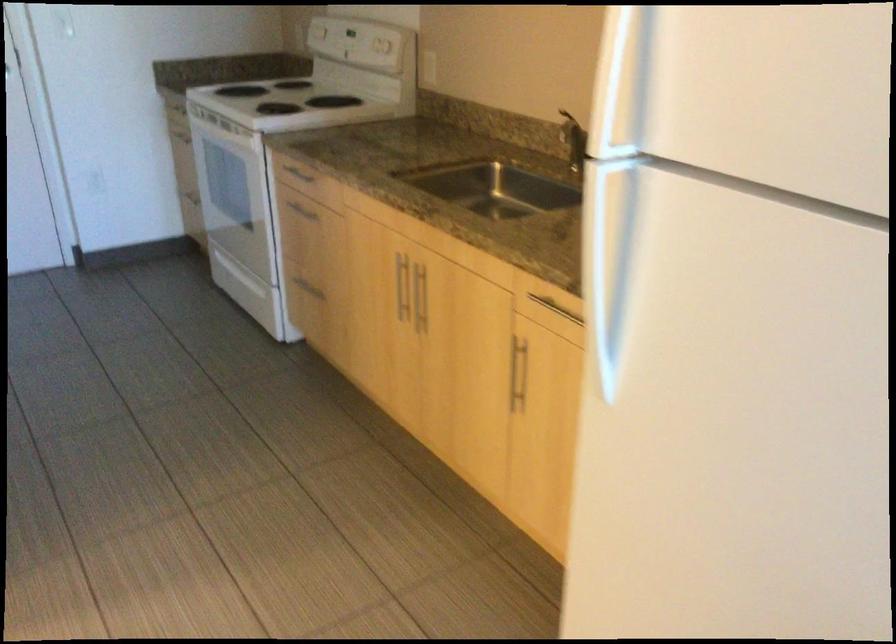
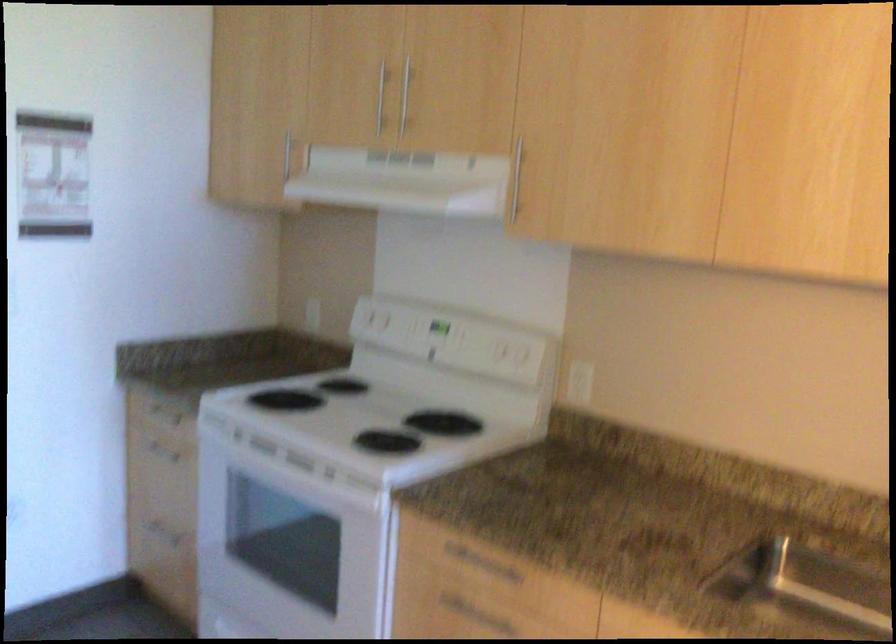
Which direction would the cameraman need to move to produce the second image?

The cameraman walked toward left, forward.